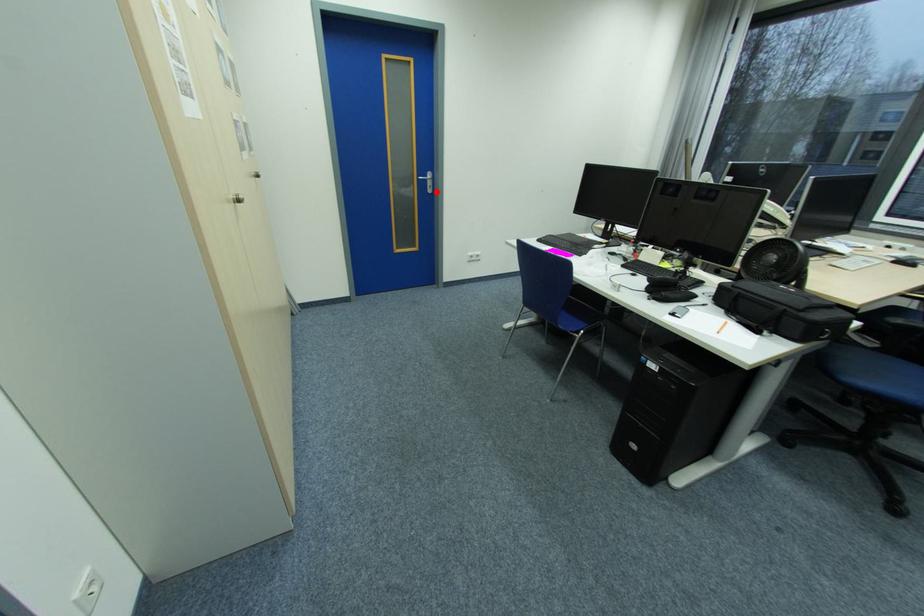
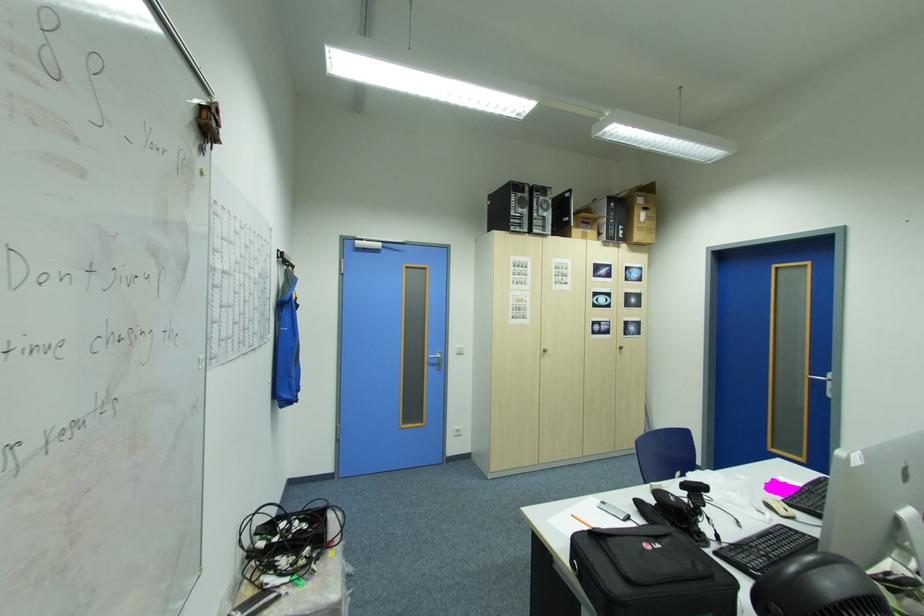
Locate, in the second image, the point that corresponds to the highlighted location in the first image.

(836, 397)